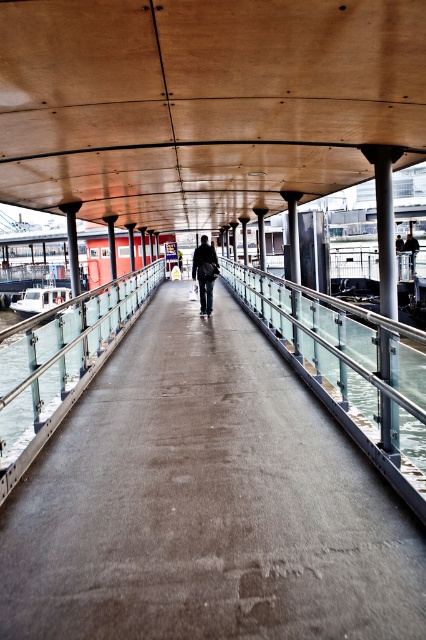
Looking at this image, you are a maintenance worker checking the walkway structure. You notice the wooden ceiling at center and the clear glass railing at left. Which object is positioned higher relative to the other?

The wooden ceiling at center is above the clear glass railing at left, so it is positioned higher.

In the scene shown: You are standing on the walkway and want to place a 20 feet long banner between the concrete walkway at center and the dark gray fabric jacket at center. Will the banner fit without overlapping either object?

The distance between the concrete walkway at center and the dark gray fabric jacket at center is 21.59 feet, so a 20 feet long banner will fit without overlapping either object since it is shorter than the available space.

You are a delivery person carrying a large box that is 1.2 meters wide. You need to pass through the concrete walkway at center while avoiding the dark gray fabric jacket at center. Is there enough space for your box to move through safely?

The concrete walkway at center might be wider than dark gray fabric jacket at center, so there could be sufficient space for the 1.2 meters wide box to pass through safely by navigating around the jacket.